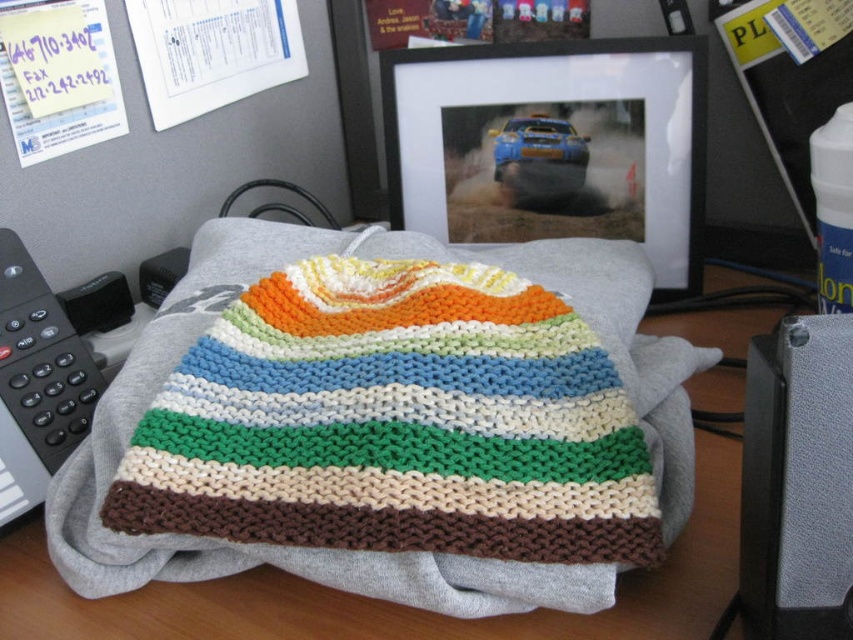
Who is shorter, gray fabric at center or gray textured speaker at lower right?

With less height is gray textured speaker at lower right.

Is point (656, 332) less distant than point (757, 378)?

That is False.

Identify the location of gray fabric at center. (364, 598).